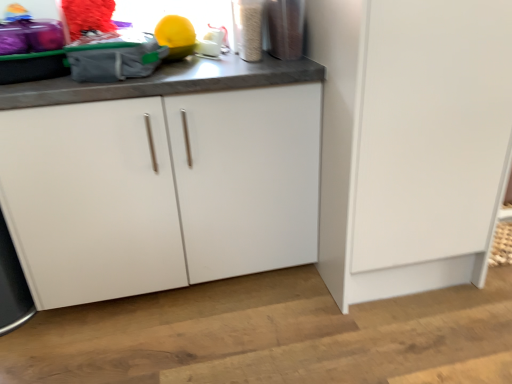
Locate an element on the screen. free spot in front of metallic silver canister at upper right, positioned as the second appliance in right-to-left order is located at coordinates (236, 63).